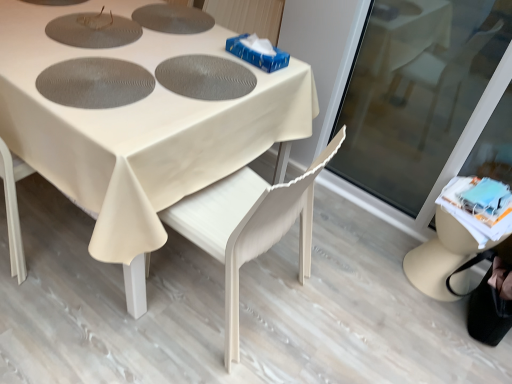
Identify the location of vacant space underneath white wood chair at center (from a real-world perspective). (243, 292).